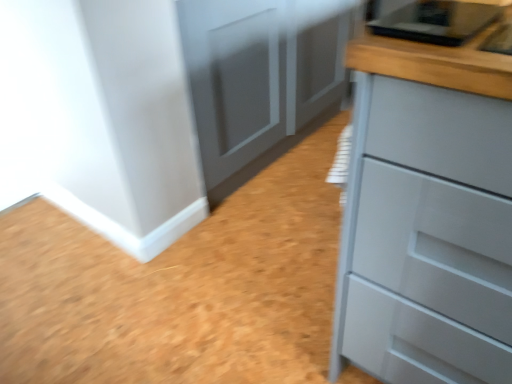
The width and height of the screenshot is (512, 384). In order to click on free space in front of matte gray cupboard at center in this screenshot , I will do `click(221, 253)`.